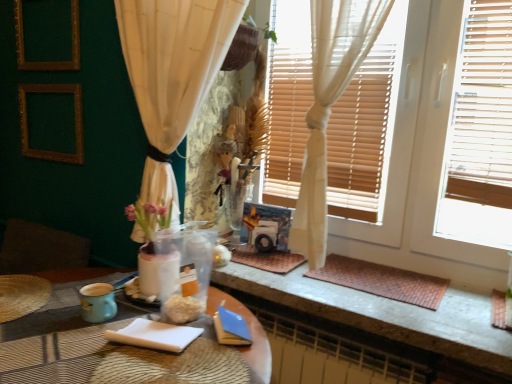
The height and width of the screenshot is (384, 512). Identify the location of vacant space in between teal ceramic mug at lower left and white paper notepad at lower center. (112, 321).